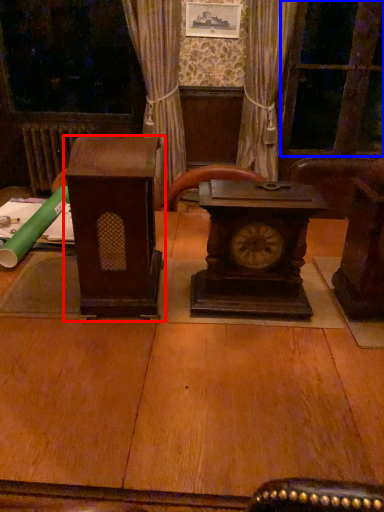
Question: Which point is further to the camera, furniture (highlighted by a red box) or glass door (highlighted by a blue box)?

Choices:
 (A) furniture
 (B) glass door

Answer: (B)